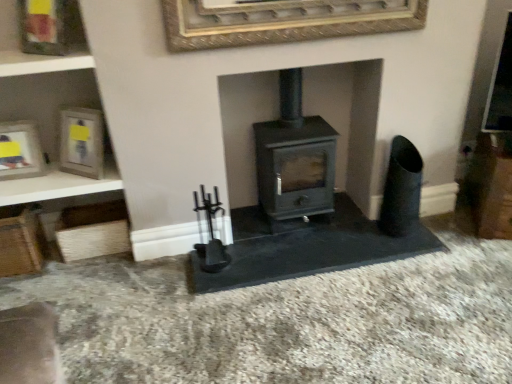
Identify the location of empty space that is ontop of matte gray wood burning stove at center. The image size is (512, 384). (287, 128).